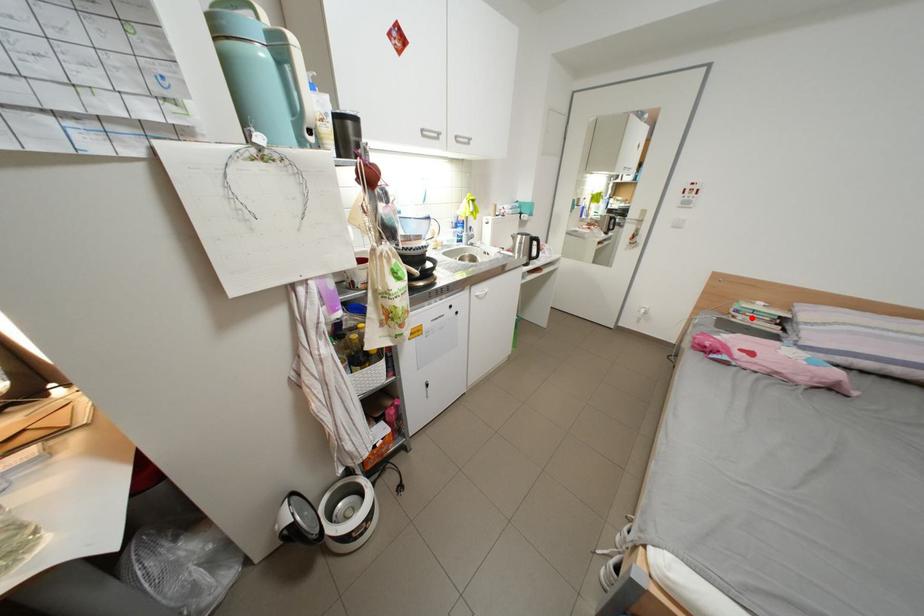
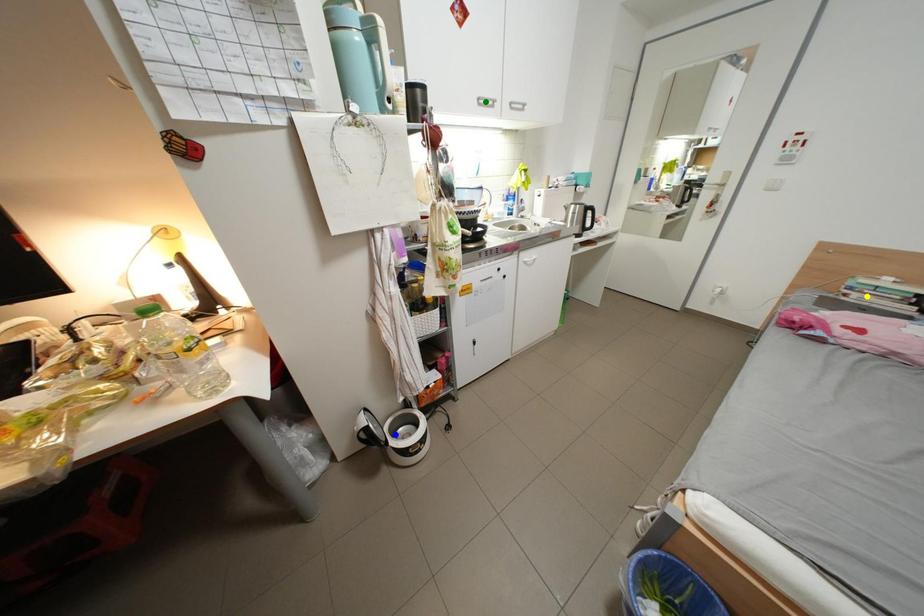
Question: I am providing you with two images of the same scene from different viewpoints. A red point is marked on the first image. You are given multiple points on the second image. Which mark in image 2 goes with the point in image 1?

Choices:
 (A) yellow point
 (B) blue point
 (C) green point

Answer: (A)